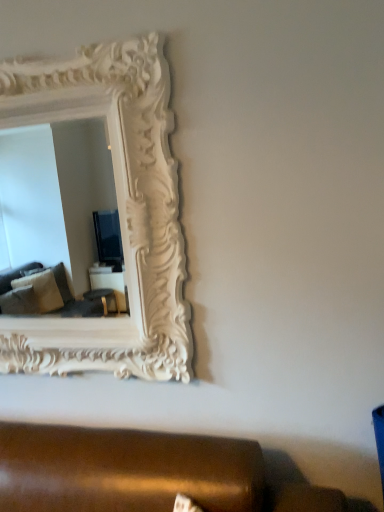
Question: Is white carved wood picture frame at upper left further to the viewer compared to brown leather studio couch at lower center?

Choices:
 (A) no
 (B) yes

Answer: (B)

Question: Can you confirm if white carved wood picture frame at upper left is smaller than brown leather studio couch at lower center?

Choices:
 (A) yes
 (B) no

Answer: (B)

Question: From the image's perspective, does white carved wood picture frame at upper left appear higher than brown leather studio couch at lower center?

Choices:
 (A) no
 (B) yes

Answer: (B)

Question: Is white carved wood picture frame at upper left thinner than brown leather studio couch at lower center?

Choices:
 (A) yes
 (B) no

Answer: (A)

Question: Considering the relative sizes of white carved wood picture frame at upper left and brown leather studio couch at lower center in the image provided, is white carved wood picture frame at upper left bigger than brown leather studio couch at lower center?

Choices:
 (A) no
 (B) yes

Answer: (B)

Question: Can you confirm if white carved wood picture frame at upper left is shorter than brown leather studio couch at lower center?

Choices:
 (A) no
 (B) yes

Answer: (A)

Question: Considering the relative sizes of brown leather studio couch at lower center and white carved wood picture frame at upper left in the image provided, is brown leather studio couch at lower center bigger than white carved wood picture frame at upper left?

Choices:
 (A) no
 (B) yes

Answer: (A)

Question: Considering the relative sizes of brown leather studio couch at lower center and white carved wood picture frame at upper left in the image provided, is brown leather studio couch at lower center thinner than white carved wood picture frame at upper left?

Choices:
 (A) yes
 (B) no

Answer: (B)

Question: Is the position of brown leather studio couch at lower center less distant than that of white carved wood picture frame at upper left?

Choices:
 (A) yes
 (B) no

Answer: (A)

Question: Are brown leather studio couch at lower center and white carved wood picture frame at upper left making contact?

Choices:
 (A) no
 (B) yes

Answer: (A)

Question: Is brown leather studio couch at lower center outside of white carved wood picture frame at upper left?

Choices:
 (A) yes
 (B) no

Answer: (A)

Question: From the image's perspective, does brown leather studio couch at lower center appear higher than white carved wood picture frame at upper left?

Choices:
 (A) yes
 (B) no

Answer: (B)

Question: From a real-world perspective, is brown leather studio couch at lower center positioned above or below white carved wood picture frame at upper left?

Choices:
 (A) above
 (B) below

Answer: (B)